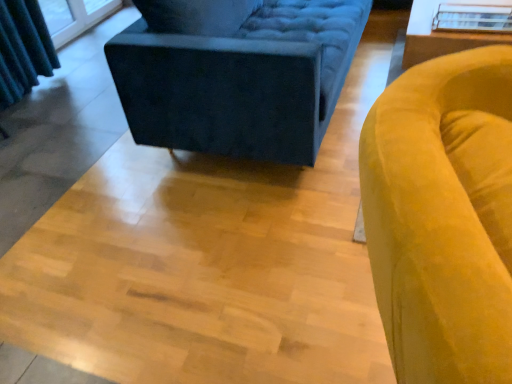
Question: Considering the relative sizes of velvet dark blue studio couch at upper center and white glossy table at upper right in the image provided, is velvet dark blue studio couch at upper center smaller than white glossy table at upper right?

Choices:
 (A) no
 (B) yes

Answer: (A)

Question: Does velvet dark blue studio couch at upper center come in front of white glossy table at upper right?

Choices:
 (A) yes
 (B) no

Answer: (A)

Question: Does velvet dark blue studio couch at upper center have a larger size compared to white glossy table at upper right?

Choices:
 (A) yes
 (B) no

Answer: (A)

Question: Does velvet dark blue studio couch at upper center have a lesser height compared to white glossy table at upper right?

Choices:
 (A) yes
 (B) no

Answer: (B)

Question: From the image's perspective, is velvet dark blue studio couch at upper center below white glossy table at upper right?

Choices:
 (A) yes
 (B) no

Answer: (B)

Question: Can you confirm if velvet dark blue studio couch at upper center is thinner than white glossy table at upper right?

Choices:
 (A) no
 (B) yes

Answer: (A)

Question: Is white glossy table at upper right shorter than velvet dark blue studio couch at upper center?

Choices:
 (A) yes
 (B) no

Answer: (A)

Question: Can you see white glossy table at upper right touching velvet dark blue studio couch at upper center?

Choices:
 (A) yes
 (B) no

Answer: (B)

Question: Is white glossy table at upper right to the right of velvet dark blue studio couch at upper center from the viewer's perspective?

Choices:
 (A) no
 (B) yes

Answer: (B)

Question: Could you tell me if white glossy table at upper right is turned towards velvet dark blue studio couch at upper center?

Choices:
 (A) no
 (B) yes

Answer: (A)

Question: Can you confirm if white glossy table at upper right is positioned to the left of velvet dark blue studio couch at upper center?

Choices:
 (A) no
 (B) yes

Answer: (A)

Question: From a real-world perspective, is white glossy table at upper right on top of velvet dark blue studio couch at upper center?

Choices:
 (A) yes
 (B) no

Answer: (B)

Question: Is velvet yellow armchair at right beside velvet dark blue studio couch at upper center?

Choices:
 (A) no
 (B) yes

Answer: (A)